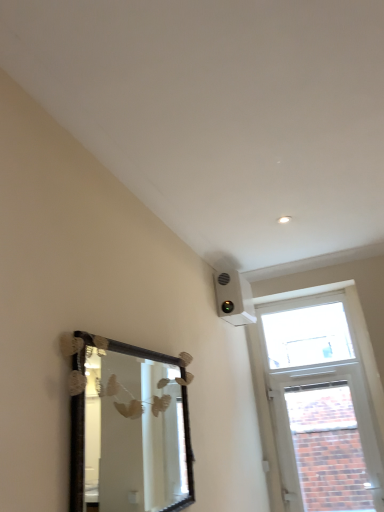
Question: Is transparent glass window at upper right, the 1th window when ordered from top to bottom, not inside brick textured window at upper right, which is the 1th window in bottom-to-top order?

Choices:
 (A) no
 (B) yes

Answer: (B)

Question: Considering the relative sizes of transparent glass window at upper right, the 1th window when ordered from top to bottom, and brick textured window at upper right, which ranks as the 2th window in top-to-bottom order, in the image provided, is transparent glass window at upper right, the 1th window when ordered from top to bottom, wider than brick textured window at upper right, which ranks as the 2th window in top-to-bottom order,?

Choices:
 (A) yes
 (B) no

Answer: (B)

Question: From a real-world perspective, is transparent glass window at upper right, the 1th window when ordered from top to bottom, positioned under brick textured window at upper right, which ranks as the 2th window in top-to-bottom order, based on gravity?

Choices:
 (A) no
 (B) yes

Answer: (A)

Question: Does transparent glass window at upper right, which is the second window in bottom-to-top order, lie behind brick textured window at upper right, which is the 1th window in bottom-to-top order?

Choices:
 (A) yes
 (B) no

Answer: (A)

Question: Does transparent glass window at upper right, which is the second window in bottom-to-top order, have a larger size compared to brick textured window at upper right, which is the 1th window in bottom-to-top order?

Choices:
 (A) yes
 (B) no

Answer: (B)

Question: Considering the relative positions of transparent glass window at upper right, the 1th window when ordered from top to bottom, and brick textured window at upper right, which ranks as the 2th window in top-to-bottom order, in the image provided, is transparent glass window at upper right, the 1th window when ordered from top to bottom, to the right of brick textured window at upper right, which ranks as the 2th window in top-to-bottom order, from the viewer's perspective?

Choices:
 (A) no
 (B) yes

Answer: (A)

Question: Is there a large distance between wooden-framed mirror at lower left and brick textured window at upper right, which is the 1th window in bottom-to-top order?

Choices:
 (A) no
 (B) yes

Answer: (B)

Question: From the image's perspective, is wooden-framed mirror at lower left above brick textured window at upper right, which is the 1th window in bottom-to-top order?

Choices:
 (A) no
 (B) yes

Answer: (B)

Question: Does wooden-framed mirror at lower left have a larger size compared to brick textured window at upper right, which is the 1th window in bottom-to-top order?

Choices:
 (A) no
 (B) yes

Answer: (A)

Question: From a real-world perspective, is wooden-framed mirror at lower left located higher than brick textured window at upper right, which is the 1th window in bottom-to-top order?

Choices:
 (A) no
 (B) yes

Answer: (B)

Question: Can brick textured window at upper right, which ranks as the 2th window in top-to-bottom order, be found inside wooden-framed mirror at lower left?

Choices:
 (A) no
 (B) yes

Answer: (A)

Question: Is wooden-framed mirror at lower left placed right next to brick textured window at upper right, which ranks as the 2th window in top-to-bottom order?

Choices:
 (A) yes
 (B) no

Answer: (B)

Question: From the image's perspective, is brick textured window at upper right, which ranks as the 2th window in top-to-bottom order, located beneath wooden-framed mirror at lower left?

Choices:
 (A) no
 (B) yes

Answer: (B)